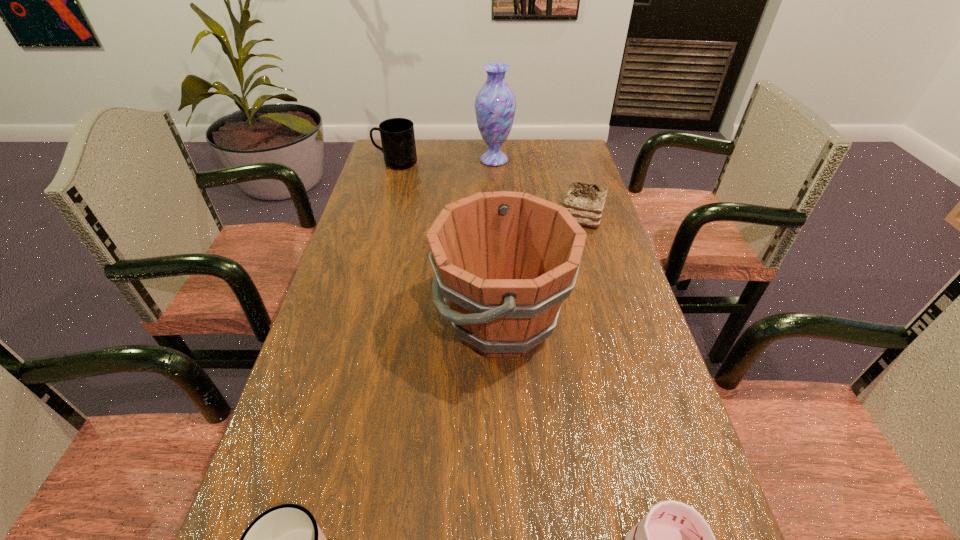
Identify which object is the fourth closest to the third tallest object. Please provide its 2D coordinates. Your answer should be formatted as a tuple, i.e. [(x, y)], where the tuple contains the x and y coordinates of a point satisfying the conditions above.

[(286, 539)]

Locate which object ranks fourth in proximity to the second tallest object. Please provide its 2D coordinates. Your answer should be formatted as a tuple, i.e. [(x, y)], where the tuple contains the x and y coordinates of a point satisfying the conditions above.

[(495, 104)]

Image resolution: width=960 pixels, height=540 pixels. In order to click on the closest mug to the third tallest object in this screenshot , I will do `click(286, 539)`.

The image size is (960, 540). In order to click on mug that is the closest to the rightmost mug in this screenshot , I will do `click(286, 539)`.

At what (x,y) coordinates should I click in order to perform the action: click on free point that satisfies the following two spatial constraints: 1. on the side of the third tallest object with the handle; 2. on the back side of the third farthest object. Please return your answer as a coordinate pair (x, y). Looking at the image, I should click on (381, 217).

Locate an element on the screen. vacant position in the image that satisfies the following two spatial constraints: 1. on the side of the tallest mug with the handle; 2. on the right side of the fourth nearest object is located at coordinates (381, 217).